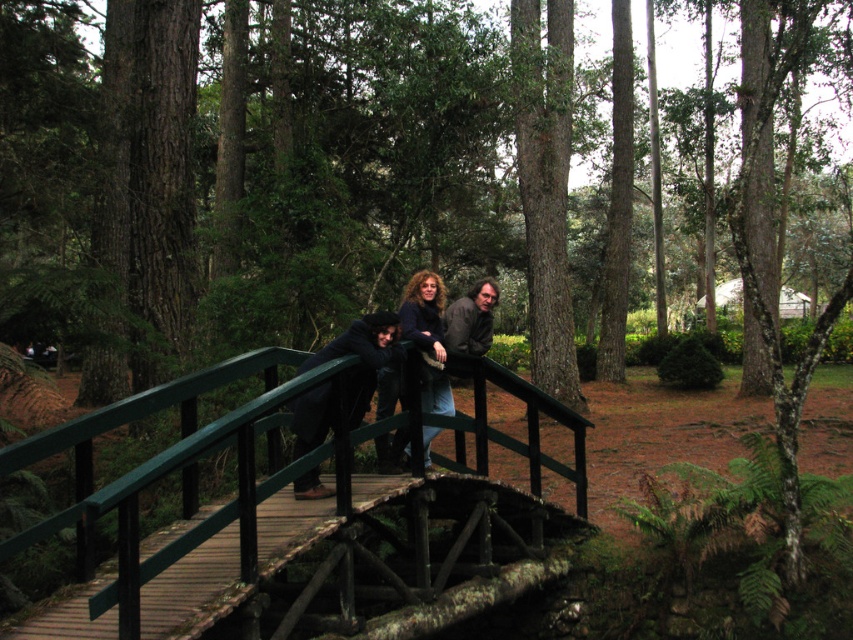
Question: Which point is closer to the camera?

Choices:
 (A) (430, 340)
 (B) (408, 515)
 (C) (422, 314)

Answer: (A)

Question: Which point is farther to the camera?

Choices:
 (A) matte black jacket at center
 (B) dark blue sweater at center

Answer: (B)

Question: Can you confirm if green wooden bridge at center is bigger than dark blue jacket at center?

Choices:
 (A) yes
 (B) no

Answer: (A)

Question: Can you confirm if green wooden bridge at center is positioned above dark blue sweater at center?

Choices:
 (A) yes
 (B) no

Answer: (B)

Question: Is dark blue jacket at center to the left of dark blue sweater at center from the viewer's perspective?

Choices:
 (A) yes
 (B) no

Answer: (A)

Question: Estimate the real-world distances between objects in this image. Which object is closer to the dark blue sweater at center?

Choices:
 (A) dark blue jacket at center
 (B) matte black jacket at center

Answer: (B)